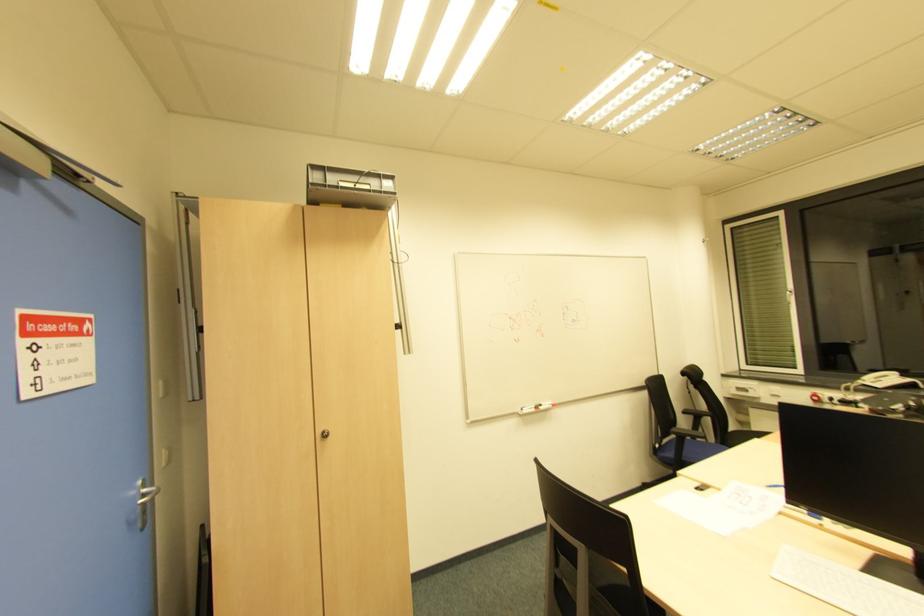
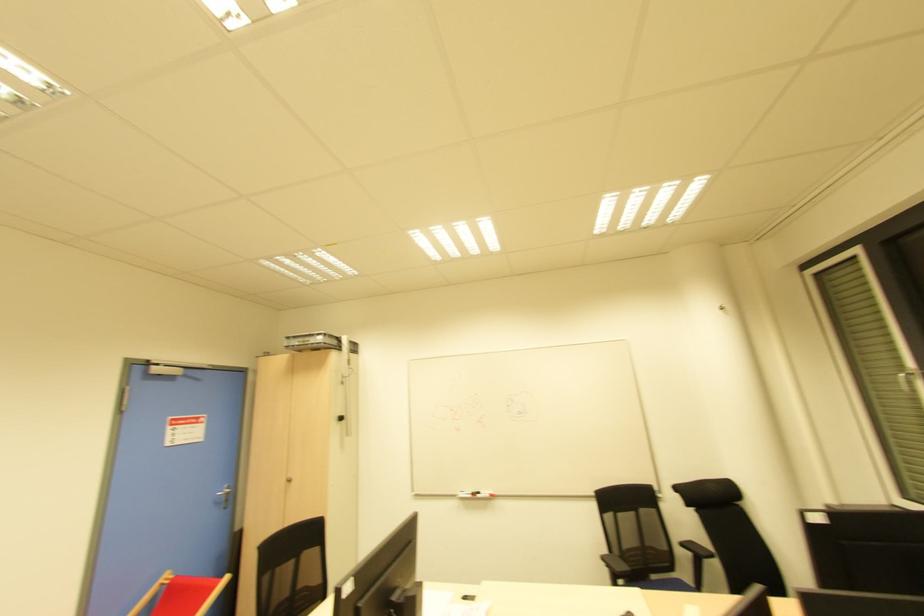
Find the pixel in the second image that matches (553,407) in the first image.

(492, 496)